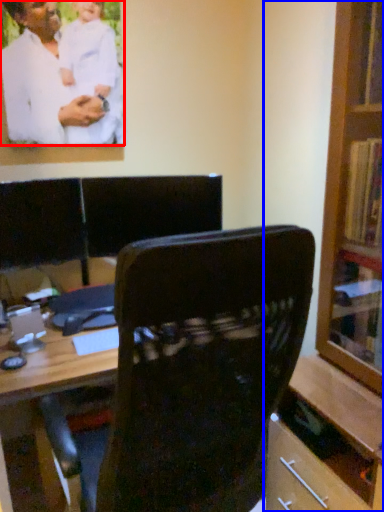
Question: Which object appears closest to the camera in this image, man (highlighted by a red box) or bookcase (highlighted by a blue box)?

Choices:
 (A) man
 (B) bookcase

Answer: (B)